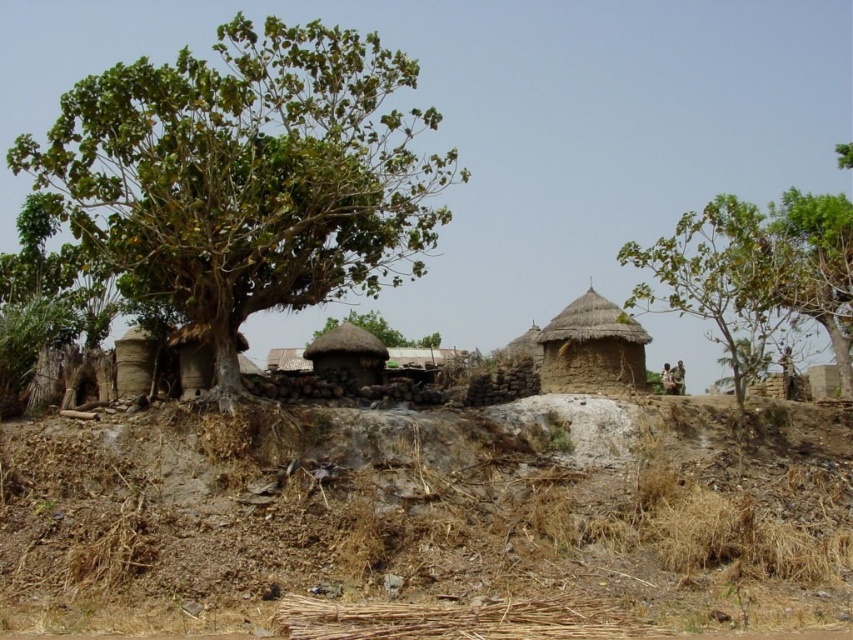
Is thatched brown hut at center taller than green thatch hut at center?

Yes.

Based on the photo, is thatched brown hut at center above green thatch hut at center?

Indeed, thatched brown hut at center is positioned over green thatch hut at center.

What do you see at coordinates (347, 353) in the screenshot? Image resolution: width=853 pixels, height=640 pixels. I see `thatched brown hut at center` at bounding box center [347, 353].

Where is `thatched brown hut at center`? This screenshot has width=853, height=640. thatched brown hut at center is located at coordinates (347, 353).

Is brown soil at lower center bigger than green thatch hut at center?

Indeed, brown soil at lower center has a larger size compared to green thatch hut at center.

Does brown soil at lower center appear under green thatch hut at center?

Correct, brown soil at lower center is located below green thatch hut at center.

Is point (247, 566) closer to camera compared to point (413, 342)?

Yes, point (247, 566) is closer to viewer.

Locate an element on the screen. The width and height of the screenshot is (853, 640). brown soil at lower center is located at coordinates point(426,516).

Does thatched straw hut at center lie in front of green thatch hut at center?

Yes, it is in front of green thatch hut at center.

Does point (608, 381) come behind point (403, 346)?

No.

Image resolution: width=853 pixels, height=640 pixels. In order to click on thatched straw hut at center in this screenshot , I will do `click(590, 348)`.